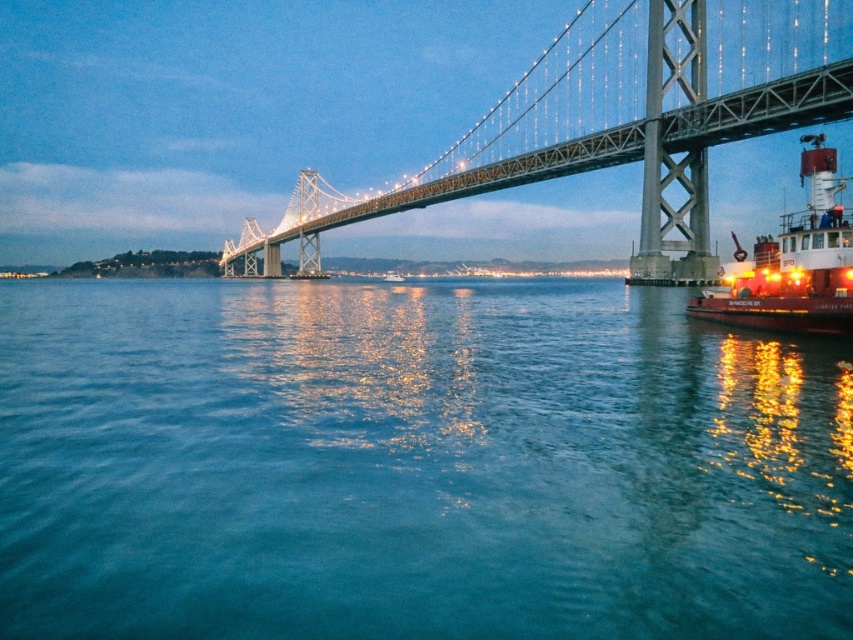
Can you confirm if blue water at center is positioned above red painted steel tugboat at right?

No.

Does blue water at center appear under red painted steel tugboat at right?

Yes.

Which is in front, point (236, 486) or point (822, 221)?

Point (236, 486) is more forward.

The image size is (853, 640). Find the location of `blue water at center`. blue water at center is located at coordinates (415, 464).

Can you confirm if metallic gray suspension bridge at upper center is bigger than red painted steel tugboat at right?

Correct, metallic gray suspension bridge at upper center is larger in size than red painted steel tugboat at right.

Is metallic gray suspension bridge at upper center shorter than red painted steel tugboat at right?

Incorrect, metallic gray suspension bridge at upper center's height does not fall short of red painted steel tugboat at right's.

Locate an element on the screen. The height and width of the screenshot is (640, 853). metallic gray suspension bridge at upper center is located at coordinates (611, 118).

Locate an element on the screen. The width and height of the screenshot is (853, 640). metallic gray suspension bridge at upper center is located at coordinates (611, 118).

Does blue water at center appear under metallic gray suspension bridge at upper center?

Yes.

What do you see at coordinates (415, 464) in the screenshot?
I see `blue water at center` at bounding box center [415, 464].

The height and width of the screenshot is (640, 853). Describe the element at coordinates (415, 464) in the screenshot. I see `blue water at center` at that location.

The width and height of the screenshot is (853, 640). What are the coordinates of `blue water at center` in the screenshot? It's located at (415, 464).